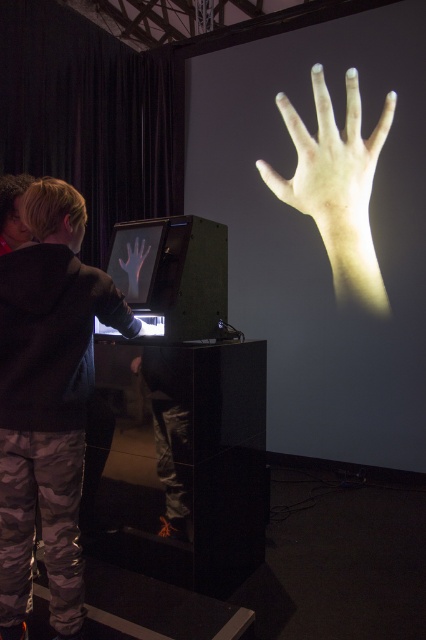
Question: Which object is farther from the camera taking this photo?

Choices:
 (A) camouflage pants at lower left
 (B) light beige skin at upper center

Answer: (B)

Question: Among these points, which one is farthest from the camera?

Choices:
 (A) (144, 243)
 (B) (28, 413)
 (C) (313, 83)

Answer: (C)

Question: From the image, what is the correct spatial relationship of light beige skin at upper center in relation to matte black hand at center?

Choices:
 (A) above
 (B) below

Answer: (A)

Question: Estimate the real-world distances between objects in this image. Which object is farther from the light beige skin at upper center?

Choices:
 (A) camouflage pants at lower left
 (B) matte black hand at center

Answer: (A)

Question: Can you confirm if light beige skin at upper center is thinner than matte black hand at center?

Choices:
 (A) yes
 (B) no

Answer: (B)

Question: Does light beige skin at upper center have a greater width compared to matte black hand at center?

Choices:
 (A) no
 (B) yes

Answer: (B)